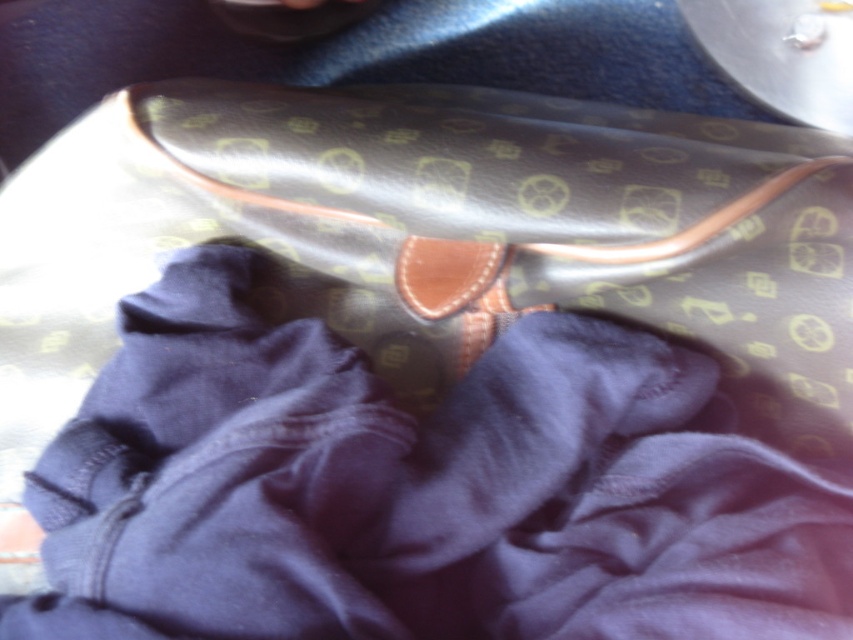
Question: Is navy blue fabric at center to the left of leather bag at center from the viewer's perspective?

Choices:
 (A) yes
 (B) no

Answer: (A)

Question: Which object appears farthest from the camera in this image?

Choices:
 (A) leather bag at center
 (B) navy blue fabric at center

Answer: (A)

Question: Where is navy blue fabric at center located in relation to leather bag at center in the image?

Choices:
 (A) left
 (B) right

Answer: (A)

Question: Which point appears closest to the camera in this image?

Choices:
 (A) (360, 225)
 (B) (538, 408)

Answer: (B)

Question: Is navy blue fabric at center positioned behind leather bag at center?

Choices:
 (A) no
 (B) yes

Answer: (A)

Question: Among these objects, which one is farthest from the camera?

Choices:
 (A) navy blue fabric at center
 (B) leather bag at center

Answer: (B)